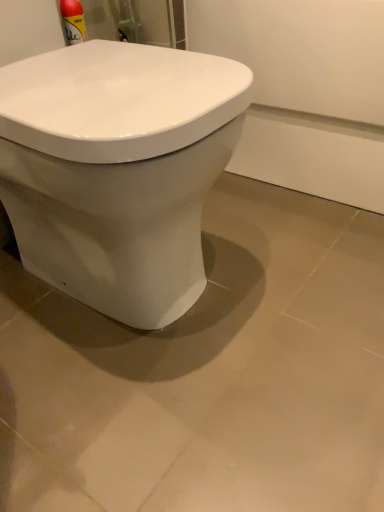
Where is `blank space above matte white ceramic tile at center (from a real-world perspective)`? Image resolution: width=384 pixels, height=512 pixels. blank space above matte white ceramic tile at center (from a real-world perspective) is located at coordinates (188, 307).